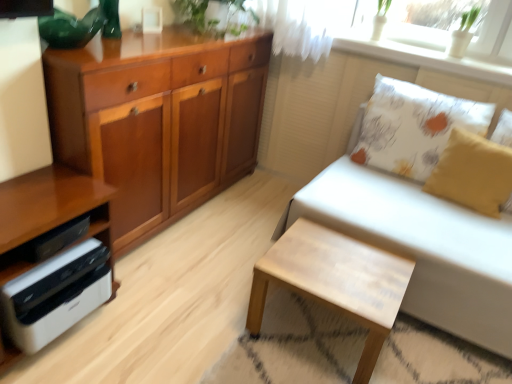
Image resolution: width=512 pixels, height=384 pixels. In order to click on free spot to the right of white leather stool at lower right in this screenshot , I will do `click(425, 356)`.